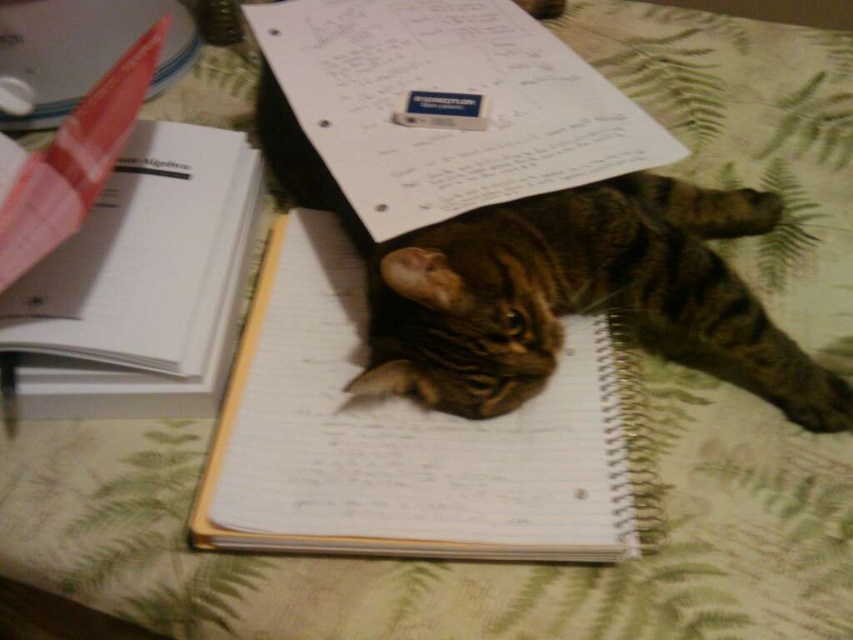
Question: Which object is farther from the camera taking this photo?

Choices:
 (A) white paper at center
 (B) spiral-bound paper notebook at center
 (C) tabby fur cat at center
 (D) white paper notebook at upper left

Answer: (D)

Question: Which point is farther to the camera?

Choices:
 (A) (207, 323)
 (B) (445, 307)
 (C) (517, 477)

Answer: (A)

Question: Is tabby fur cat at center bigger than white paper at center?

Choices:
 (A) yes
 (B) no

Answer: (B)

Question: Does spiral-bound paper notebook at center appear under white paper notebook at upper left?

Choices:
 (A) no
 (B) yes

Answer: (B)

Question: Is spiral-bound paper notebook at center above white paper notebook at upper left?

Choices:
 (A) yes
 (B) no

Answer: (B)

Question: Which object appears farthest from the camera in this image?

Choices:
 (A) spiral-bound paper notebook at center
 (B) white paper notebook at upper left

Answer: (B)